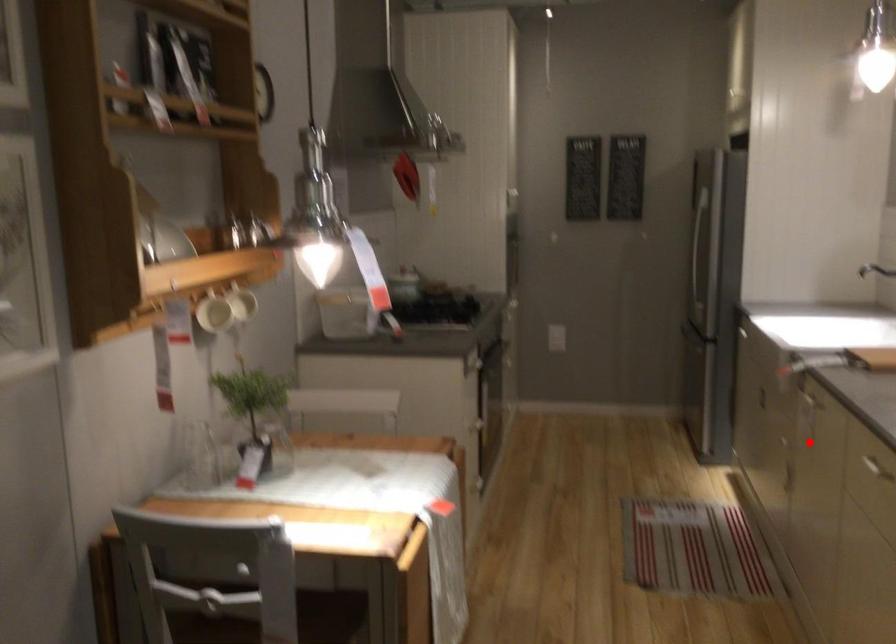
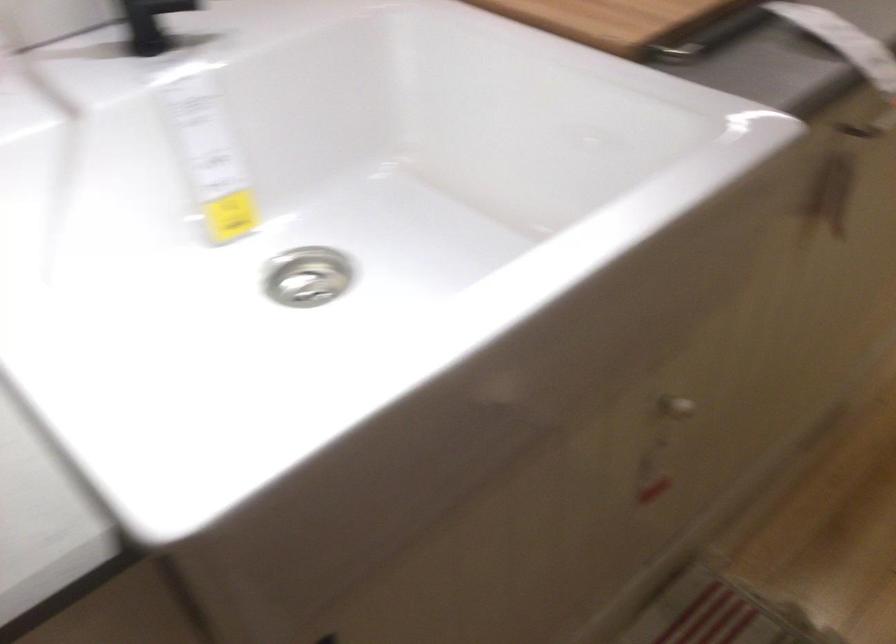
Question: A red point is marked in image1. In image2, is the corresponding 3D point closer to the camera or farther? Reply with the corresponding letter.

Choices:
 (A) The corresponding 3D point is closer.
 (B) The corresponding 3D point is farther.

Answer: (A)